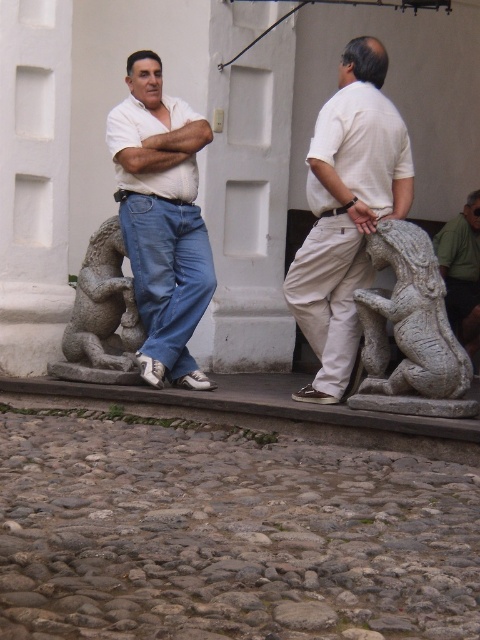
Question: Where is matte white shirt at center located in relation to granite lion at left in the image?

Choices:
 (A) above
 (B) below

Answer: (A)

Question: Does khaki pants at center appear under gray stone lion at right?

Choices:
 (A) no
 (B) yes

Answer: (A)

Question: Which point is closer to the camera?

Choices:
 (A) gray stone lion at right
 (B) smooth gray stone statue at right
 (C) matte white shirt at center

Answer: (A)

Question: Is khaki pants at center to the left of matte white shirt at center from the viewer's perspective?

Choices:
 (A) no
 (B) yes

Answer: (A)

Question: Which of the following is the farthest from the observer?

Choices:
 (A) gray stone lion at right
 (B) smooth gray stone statue at right
 (C) granite lion at left
 (D) matte white shirt at center

Answer: (B)

Question: Which point is farther to the camera?

Choices:
 (A) khaki pants at center
 (B) granite lion at left
 (C) smooth gray stone statue at right
 (D) matte white shirt at center

Answer: (C)